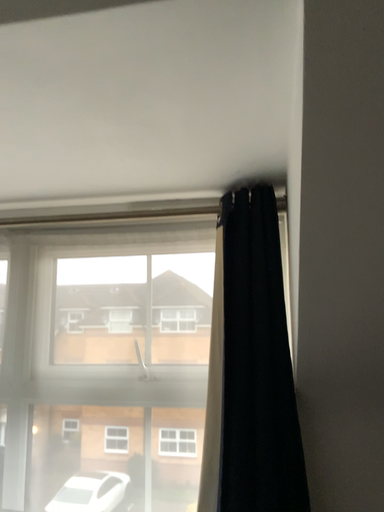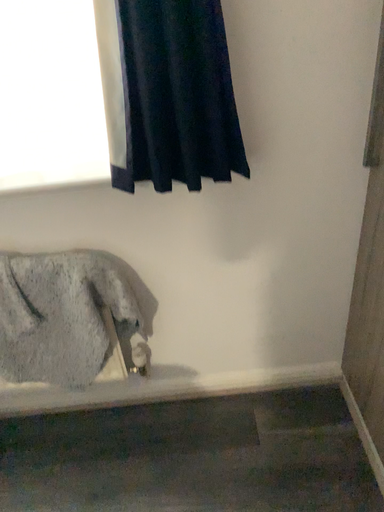
Question: Which way did the camera rotate in the video?

Choices:
 (A) rotated right
 (B) rotated left

Answer: (A)